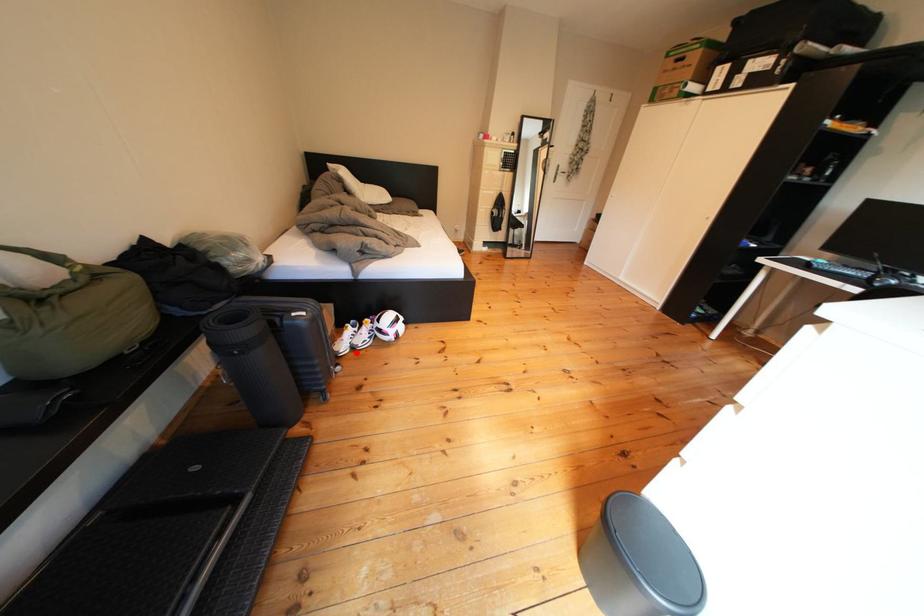
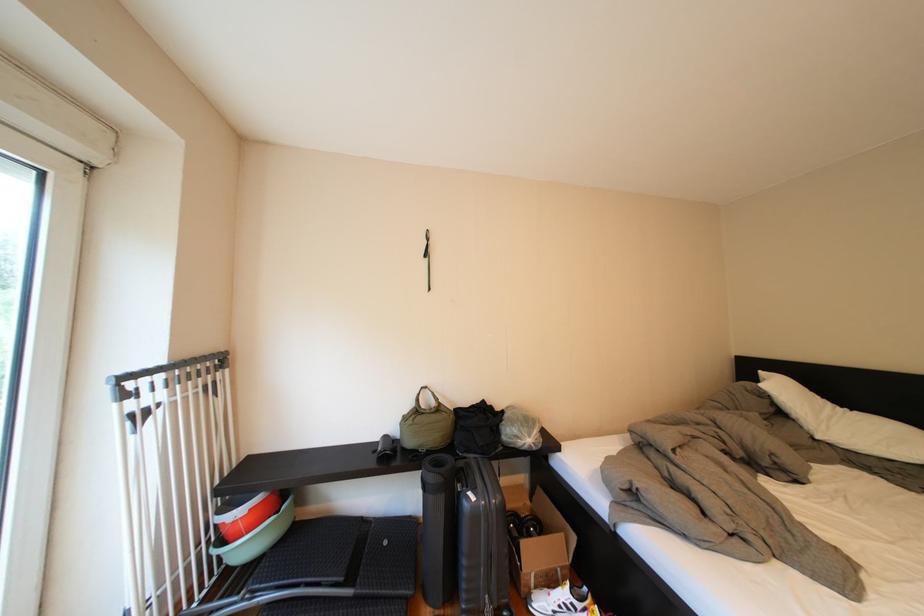
In the second image, find the point that corresponds to the highlighted location in the first image.

(554, 609)